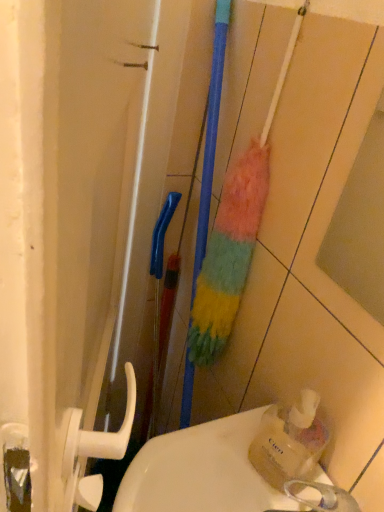
Question: Considering the positions of translucent plastic soap dispenser at lower right and multicolored fuzzy brush at center in the image, is translucent plastic soap dispenser at lower right taller or shorter than multicolored fuzzy brush at center?

Choices:
 (A) tall
 (B) short

Answer: (B)

Question: In the image, is translucent plastic soap dispenser at lower right positioned in front of or behind multicolored fuzzy brush at center?

Choices:
 (A) front
 (B) behind

Answer: (A)

Question: Based on their relative distances, which object is nearer to the translucent plastic soap dispenser at lower right?

Choices:
 (A) multicolored fuzzy brush at center
 (B) white glossy sink at lower center

Answer: (B)

Question: Which is nearer to the translucent plastic soap dispenser at lower right?

Choices:
 (A) multicolored fuzzy brush at center
 (B) white glossy sink at lower center

Answer: (B)